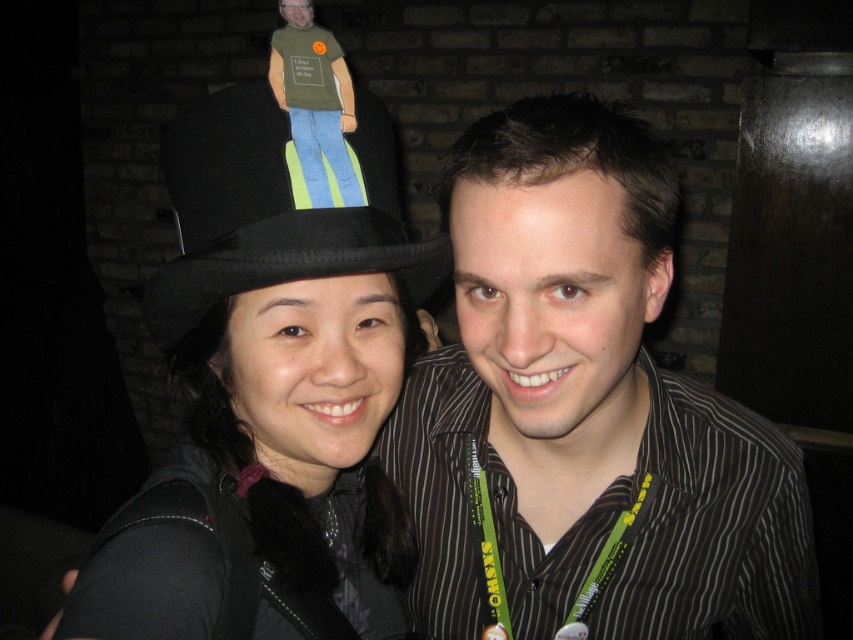
Does striped cotton shirt at center have a greater width compared to black felt hat at upper left?

Correct, the width of striped cotton shirt at center exceeds that of black felt hat at upper left.

Does striped cotton shirt at center have a smaller size compared to black felt hat at upper left?

Incorrect, striped cotton shirt at center is not smaller in size than black felt hat at upper left.

Image resolution: width=853 pixels, height=640 pixels. Describe the element at coordinates (585, 408) in the screenshot. I see `striped cotton shirt at center` at that location.

You are a GUI agent. You are given a task and a screenshot of the screen. Output one action in this format:
    pyautogui.click(x=<x>, y=<y>)
    Task: Click on the striped cotton shirt at center
    The width and height of the screenshot is (853, 640).
    Given the screenshot: What is the action you would take?
    pyautogui.click(x=585, y=408)

Which is behind, point (700, 588) or point (239, 230)?

The point (700, 588) is more distant.

Does striped cotton shirt at center appear on the right side of black felt fedora at upper left?

Correct, you'll find striped cotton shirt at center to the right of black felt fedora at upper left.

What do you see at coordinates (585, 408) in the screenshot? This screenshot has width=853, height=640. I see `striped cotton shirt at center` at bounding box center [585, 408].

What are the coordinates of `striped cotton shirt at center` in the screenshot? It's located at (585, 408).

Can you confirm if black felt hat at upper left is positioned to the right of black felt fedora at upper left?

No, black felt hat at upper left is not to the right of black felt fedora at upper left.

Is the position of black felt hat at upper left more distant than that of black felt fedora at upper left?

Yes, black felt hat at upper left is behind black felt fedora at upper left.

The image size is (853, 640). In order to click on black felt hat at upper left in this screenshot , I will do `click(270, 396)`.

Locate an element on the screen. The width and height of the screenshot is (853, 640). black felt hat at upper left is located at coordinates (270, 396).